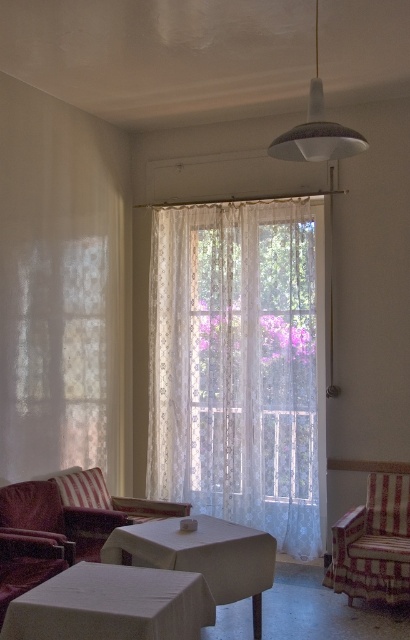
Question: Is white lace curtain at center above striped fabric pillow at lower left?

Choices:
 (A) yes
 (B) no

Answer: (A)

Question: Among these objects, which one is nearest to the camera?

Choices:
 (A) white lace curtain at center
 (B) striped fabric pillow at lower left
 (C) velvet red armchair at lower left

Answer: (C)

Question: Which object appears farthest from the camera in this image?

Choices:
 (A) white lace curtain at center
 (B) white cloth-covered table at center
 (C) striped fabric pillow at lower left

Answer: (A)

Question: Does striped fabric armchair at lower right appear on the right side of velvet red armchair at lower left?

Choices:
 (A) no
 (B) yes

Answer: (B)

Question: Is velvet red armchair at lower left further to camera compared to white matte lampshade at upper center?

Choices:
 (A) no
 (B) yes

Answer: (B)

Question: Which object is positioned farthest from the velvet red armchair at lower left?

Choices:
 (A) white cloth-covered table at center
 (B) white lace curtain at center
 (C) white cloth-covered table at lower center

Answer: (B)